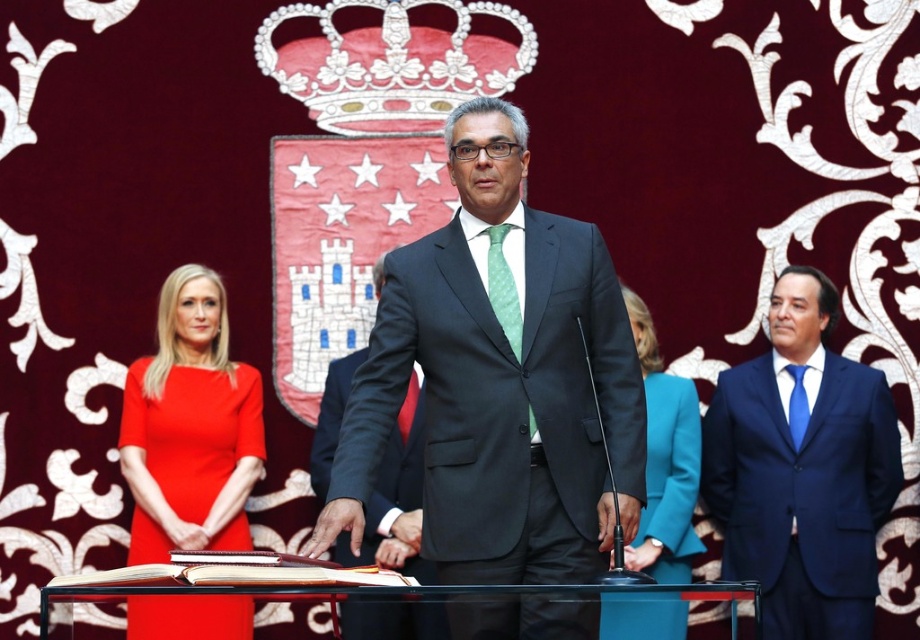
Question: Is matte black suit at center positioned at the back of white textured crown at upper center?

Choices:
 (A) no
 (B) yes

Answer: (A)

Question: From the image, what is the correct spatial relationship of white textured crown at upper center in relation to dark gray suit at center?

Choices:
 (A) above
 (B) below

Answer: (A)

Question: Among these points, which one is farthest from the camera?

Choices:
 (A) (667, 598)
 (B) (136, 481)
 (C) (383, 1)

Answer: (C)

Question: Which of these objects is positioned farthest from the green dotted fabric tie at center?

Choices:
 (A) teal fabric jacket at lower center
 (B) matte black suit at center
 (C) green silk tie at center
 (D) blue silk tie at right

Answer: (D)

Question: Is matte red dress at left positioned in front of white textured crown at upper center?

Choices:
 (A) no
 (B) yes

Answer: (B)

Question: Which point is closer to the camera?

Choices:
 (A) teal fabric jacket at lower center
 (B) dark gray suit at center
 (C) green matte tie at center
 (D) blue silk tie at right

Answer: (B)